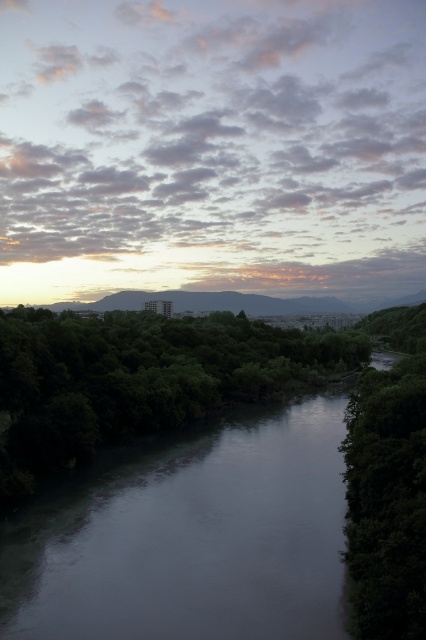
You are an artist planning to paint the landscape. You want to ensure the green leafy trees at lower left and the green leafy tree at right are proportionally accurate. Which tree should you make wider in your painting?

The green leafy trees at lower left should be made wider in the painting since their width surpasses that of the green leafy tree at right.

You are an environmental scientist studying the river and trees in the image. The smooth gray river at center is crucial for the local ecosystem. Can you determine if the river is narrower than the green leafy trees at lower left based on the scene?

The smooth gray river at center is thinner than green leafy trees at lower left, so yes, the river is narrower than the green leafy trees at lower left.